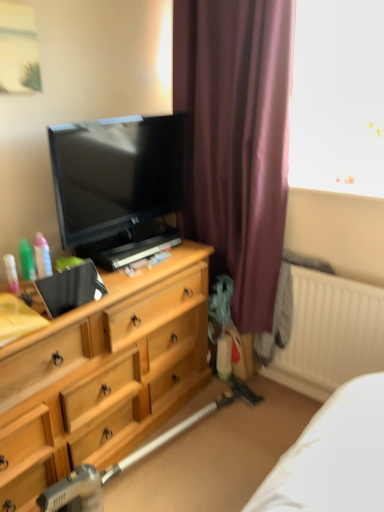
Where is `free space above white ribbed radiator at right (from a real-world perspective)`? This screenshot has width=384, height=512. free space above white ribbed radiator at right (from a real-world perspective) is located at coordinates (336, 276).